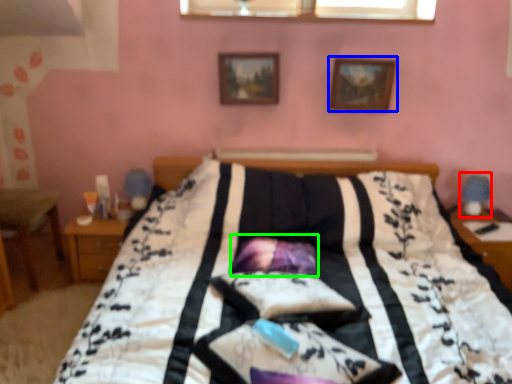
Question: Which is nearer to the table lamp (highlighted by a red box)? picture frame (highlighted by a blue box) or pillow (highlighted by a green box).

Choices:
 (A) picture frame
 (B) pillow

Answer: (A)